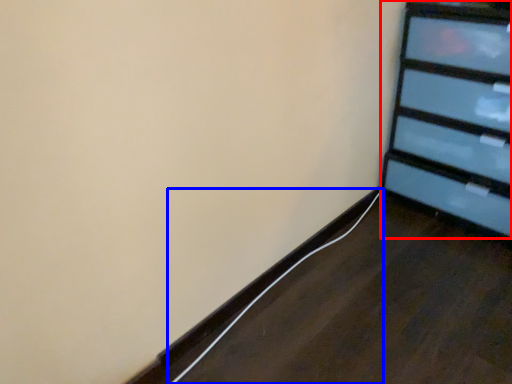
Question: Which point is further to the camera, furniture (highlighted by a red box) or cable (highlighted by a blue box)?

Choices:
 (A) furniture
 (B) cable

Answer: (B)